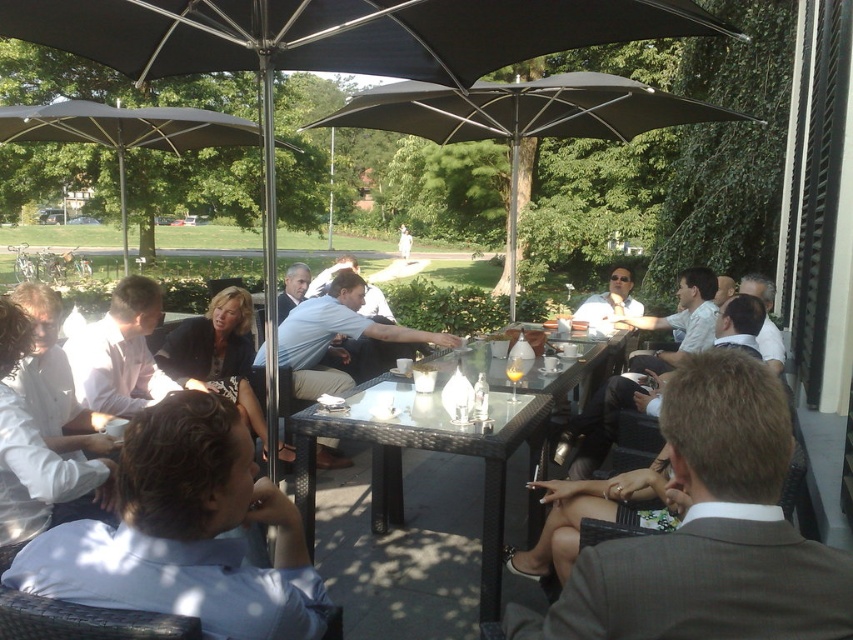
From the picture: Is brown leather jacket at center below white shirt at left?

Correct, brown leather jacket at center is located below white shirt at left.

Between point (730, 396) and point (7, 364), which one is positioned in front?

Positioned in front is point (730, 396).

Image resolution: width=853 pixels, height=640 pixels. What are the coordinates of `brown leather jacket at center` in the screenshot? It's located at (709, 532).

Does brown leather jacket at center appear on the left side of transparent glass table at center?

Yes, brown leather jacket at center is to the left of transparent glass table at center.

Does point (706, 410) come farther from viewer compared to point (456, 444)?

No, it is not.

Where is `brown leather jacket at center`? brown leather jacket at center is located at coordinates (709, 532).

Which is below, white shirt at center or translucent glass cup at center?

white shirt at center is lower down.

Does point (97, 602) come in front of point (508, 371)?

Yes, point (97, 602) is closer to viewer.

At what (x,y) coordinates should I click in order to perform the action: click on white shirt at center. Please return your answer as a coordinate pair (x, y). Image resolution: width=853 pixels, height=640 pixels. Looking at the image, I should click on (184, 532).